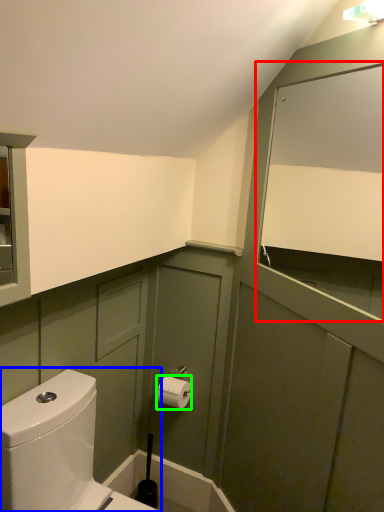
Question: Considering the real-world distances, which object is farthest from mirror (highlighted by a red box)? toilet (highlighted by a blue box) or toiletry (highlighted by a green box)?

Choices:
 (A) toilet
 (B) toiletry

Answer: (A)